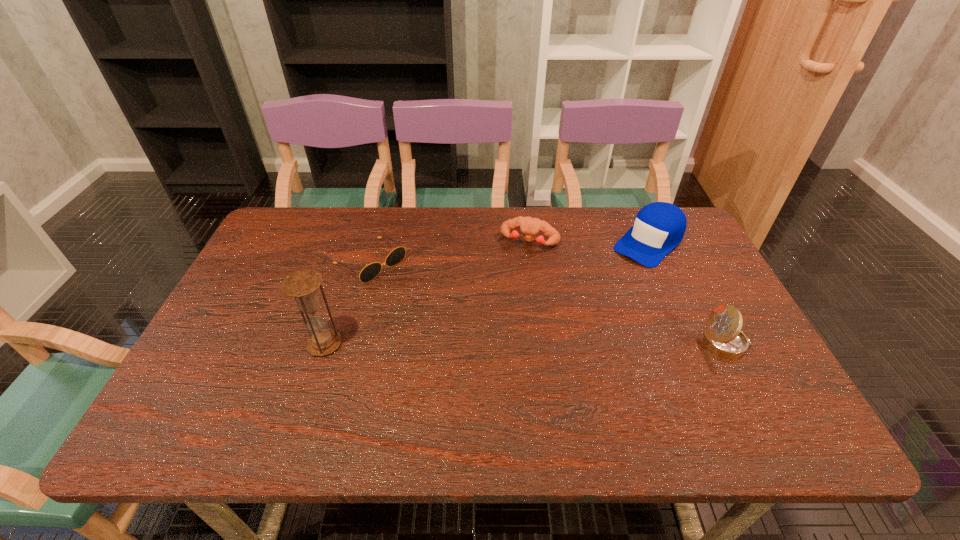
The width and height of the screenshot is (960, 540). I want to click on free space in the image that satisfies the following two spatial constraints: 1. on the back side of the shortest object; 2. on the right side of the fourth tallest object, so click(x=376, y=241).

At what (x,y) coordinates should I click in order to perform the action: click on vacant region that satisfies the following two spatial constraints: 1. on the front side of the compass; 2. with the dial facing the puncher. Please return your answer as a coordinate pair (x, y). Image resolution: width=960 pixels, height=540 pixels. Looking at the image, I should click on (543, 344).